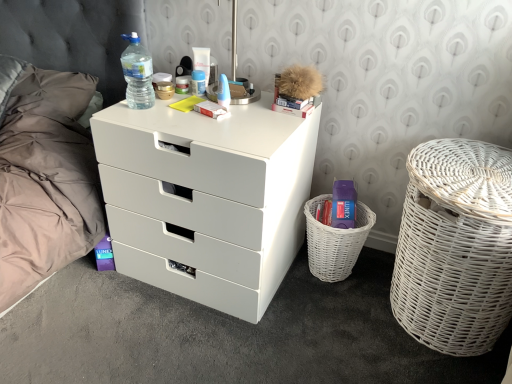
The height and width of the screenshot is (384, 512). Identify the location of vacant space in front of matte plastic container at center, which is counted as the 1th toiletry, starting from the left. (176, 99).